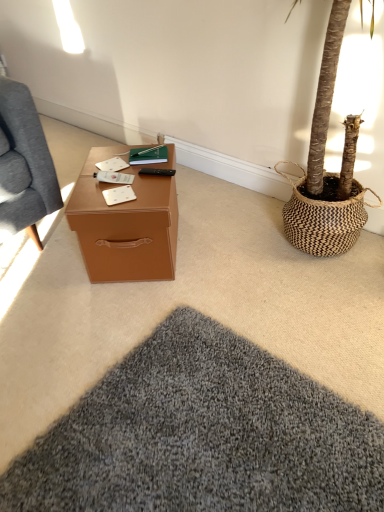
Find the location of a particular element. The height and width of the screenshot is (512, 384). free space between black matte remote control at center and white matte notepad at center is located at coordinates (141, 185).